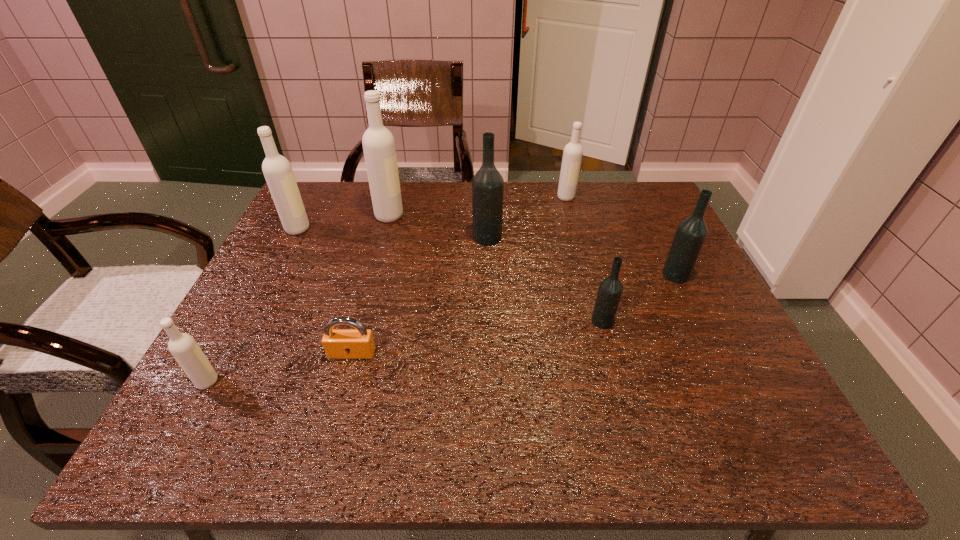
Image resolution: width=960 pixels, height=540 pixels. Identify the location of free space located 0.130m on the back of the nearest white vodka. (238, 325).

The height and width of the screenshot is (540, 960). What are the coordinates of `vacant space located on the left of the sixth farthest vodka` in the screenshot? It's located at (534, 321).

Where is `vacant space located 0.080m to unlock the shortest object from the front`? The height and width of the screenshot is (540, 960). vacant space located 0.080m to unlock the shortest object from the front is located at coordinates (341, 393).

You are a GUI agent. You are given a task and a screenshot of the screen. Output one action in this format:
    pyautogui.click(x=<x>, y=<y>)
    Task: Click on the object that is at the right edge
    The width and height of the screenshot is (960, 540).
    Given the screenshot: What is the action you would take?
    pyautogui.click(x=691, y=233)

This screenshot has width=960, height=540. I want to click on object located at the far left corner, so click(277, 170).

You are a GUI agent. You are given a task and a screenshot of the screen. Output one action in this format:
    pyautogui.click(x=<x>, y=<y>)
    Task: Click on the vacant area at the far edge of the desktop
    The height and width of the screenshot is (540, 960).
    Given the screenshot: What is the action you would take?
    pyautogui.click(x=542, y=195)

The image size is (960, 540). I want to click on free space at the near edge of the desktop, so click(345, 421).

The image size is (960, 540). I want to click on blank space at the left edge, so click(x=316, y=284).

Identify the location of vacant area at the right edge of the desktop. This screenshot has height=540, width=960. (643, 289).

Identify the location of blank space at the near right corner. This screenshot has height=540, width=960. (803, 455).